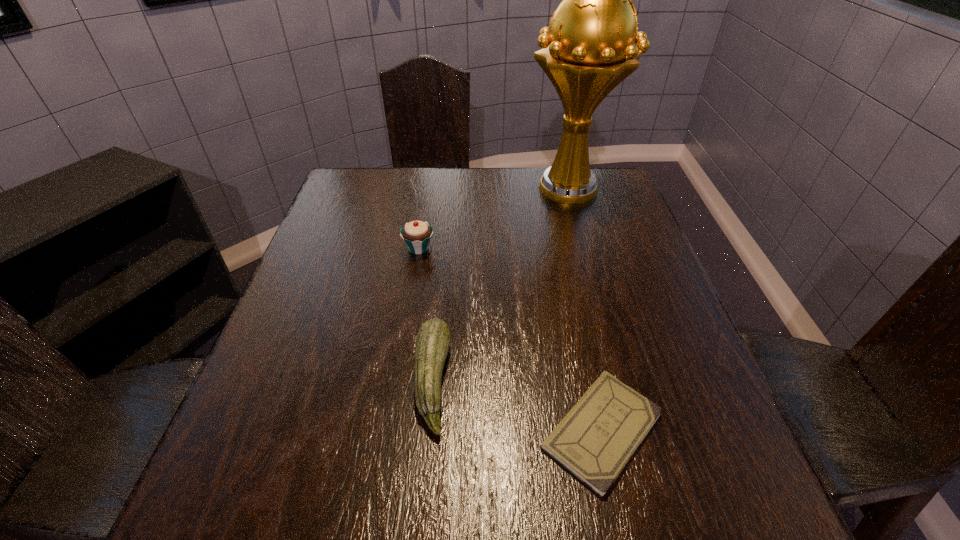
Find the location of a particular element. Image resolution: width=960 pixels, height=540 pixels. free space between the checkbook and the zucchini is located at coordinates (517, 406).

Where is `object that is the second closest to the third tallest object`? This screenshot has width=960, height=540. object that is the second closest to the third tallest object is located at coordinates (417, 234).

Where is `object that can be found as the closest to the tallest object`? object that can be found as the closest to the tallest object is located at coordinates (417, 234).

The image size is (960, 540). What are the coordinates of `free space that satisfies the following two spatial constraints: 1. at the stem end of the checkbook; 2. on the right side of the zucchini` in the screenshot? It's located at (427, 430).

At what (x,y) coordinates should I click in order to perform the action: click on free space in the image that satisfies the following two spatial constraints: 1. at the front of the trophy_cup where the globe is prominent; 2. at the stem end of the zucchini. Please return your answer as a coordinate pair (x, y). Looking at the image, I should click on (621, 381).

Where is `vacant area that satisfies the following two spatial constraints: 1. at the stem end of the zucchini; 2. on the back side of the shortest object`? The image size is (960, 540). vacant area that satisfies the following two spatial constraints: 1. at the stem end of the zucchini; 2. on the back side of the shortest object is located at coordinates (427, 430).

This screenshot has width=960, height=540. Identify the location of vacant region that satisfies the following two spatial constraints: 1. on the back side of the checkbook; 2. at the stem end of the second shortest object. (591, 381).